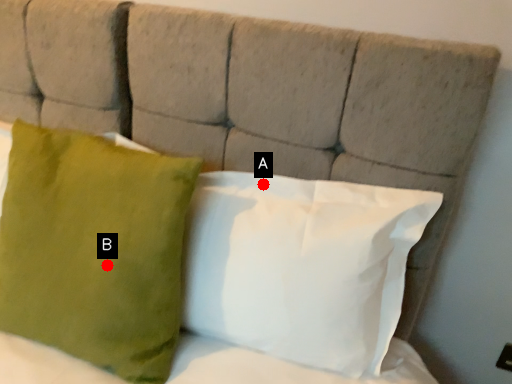
Question: Two points are circled on the image, labeled by A and B beside each circle. Which point is closer to the camera taking this photo?

Choices:
 (A) A is closer
 (B) B is closer

Answer: (B)